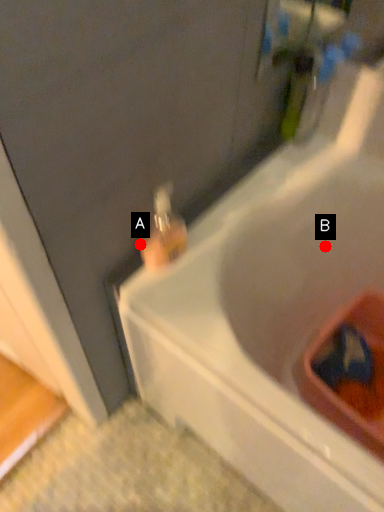
Question: Two points are circled on the image, labeled by A and B beside each circle. Which point is farther to the camera?

Choices:
 (A) A is further
 (B) B is further

Answer: (B)